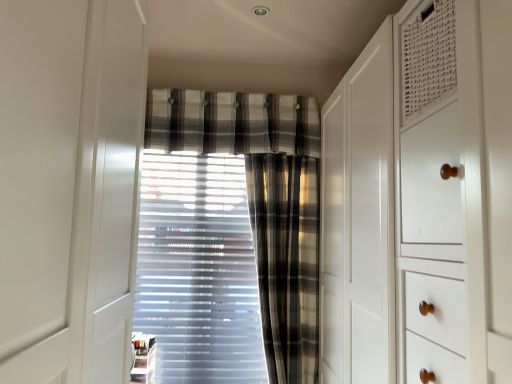
Question: Considering the relative positions of plaid fabric curtain at center, arranged as the 2th curtain when viewed from the right, and plaid fabric curtain at center, which is counted as the first curtain, starting from the right, in the image provided, is plaid fabric curtain at center, arranged as the 2th curtain when viewed from the right, to the left of plaid fabric curtain at center, which is counted as the first curtain, starting from the right, from the viewer's perspective?

Choices:
 (A) yes
 (B) no

Answer: (A)

Question: Is plaid fabric curtain at center, which is the first curtain in left-to-right order, to the right of plaid fabric curtain at center, positioned as the 2th curtain in left-to-right order, from the viewer's perspective?

Choices:
 (A) yes
 (B) no

Answer: (B)

Question: Is plaid fabric curtain at center, arranged as the 2th curtain when viewed from the right, with plaid fabric curtain at center, positioned as the 2th curtain in left-to-right order?

Choices:
 (A) no
 (B) yes

Answer: (A)

Question: From the image's perspective, is plaid fabric curtain at center, arranged as the 2th curtain when viewed from the right, under plaid fabric curtain at center, which is counted as the first curtain, starting from the right?

Choices:
 (A) yes
 (B) no

Answer: (A)

Question: Considering the relative positions of plaid fabric curtain at center, which is the first curtain in left-to-right order, and plaid fabric curtain at center, which is counted as the first curtain, starting from the right, in the image provided, is plaid fabric curtain at center, which is the first curtain in left-to-right order, in front of plaid fabric curtain at center, which is counted as the first curtain, starting from the right,?

Choices:
 (A) no
 (B) yes

Answer: (A)

Question: Is plaid fabric curtain at center, arranged as the 2th curtain when viewed from the right, not within plaid fabric curtain at center, positioned as the 2th curtain in left-to-right order?

Choices:
 (A) yes
 (B) no

Answer: (A)

Question: Can you confirm if plaid fabric curtain at center, which is the first curtain in left-to-right order, is wider than plaid fabric at center?

Choices:
 (A) yes
 (B) no

Answer: (B)

Question: From the image's perspective, is plaid fabric curtain at center, which is the first curtain in left-to-right order, below plaid fabric at center?

Choices:
 (A) no
 (B) yes

Answer: (B)

Question: Does plaid fabric curtain at center, which is the first curtain in left-to-right order, have a lesser width compared to plaid fabric at center?

Choices:
 (A) no
 (B) yes

Answer: (B)

Question: From the image's perspective, is plaid fabric curtain at center, arranged as the 2th curtain when viewed from the right, on top of plaid fabric at center?

Choices:
 (A) yes
 (B) no

Answer: (B)

Question: Is plaid fabric curtain at center, arranged as the 2th curtain when viewed from the right, turned away from plaid fabric at center?

Choices:
 (A) yes
 (B) no

Answer: (B)

Question: Is plaid fabric curtain at center, arranged as the 2th curtain when viewed from the right, aimed at plaid fabric at center?

Choices:
 (A) yes
 (B) no

Answer: (B)

Question: Is plaid fabric at center at the left side of plaid fabric curtain at center, which is the first curtain in left-to-right order?

Choices:
 (A) yes
 (B) no

Answer: (B)